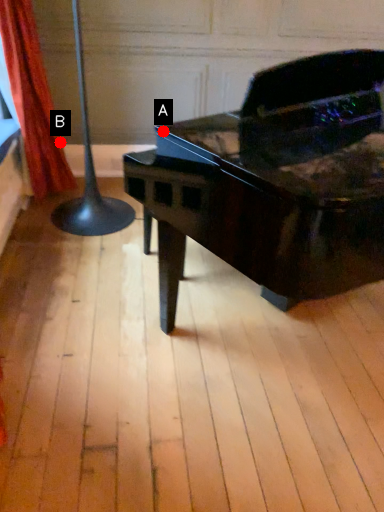
Question: Two points are circled on the image, labeled by A and B beside each circle. Which point is closer to the camera taking this photo?

Choices:
 (A) A is closer
 (B) B is closer

Answer: (A)